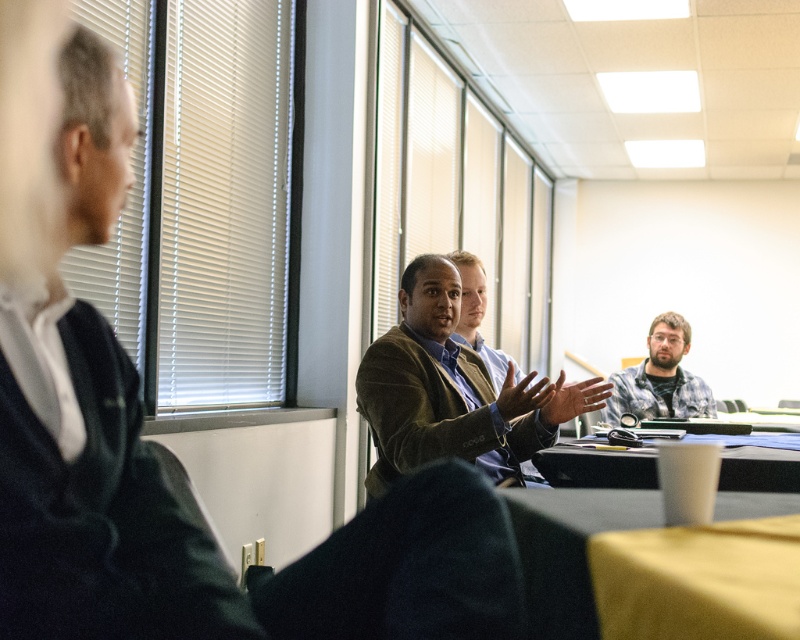
Between velvet brown blazer at center and yellow fabric table at lower right, which one has less height?

yellow fabric table at lower right

Does velvet brown blazer at center appear over yellow fabric table at lower right?

Correct, velvet brown blazer at center is located above yellow fabric table at lower right.

I want to click on velvet brown blazer at center, so click(x=452, y=392).

Measure the distance between black plastic table at lower right and plaid shirt at center.

black plastic table at lower right is 1.35 meters from plaid shirt at center.

Which of these two, black plastic table at lower right or plaid shirt at center, stands shorter?

black plastic table at lower right is shorter.

Does point (617, 480) come in front of point (628, 381)?

Yes, point (617, 480) is closer to viewer.

The image size is (800, 640). Find the location of `black plastic table at lower right`. black plastic table at lower right is located at coordinates (598, 467).

At what (x,y) coordinates should I click in order to perform the action: click on yellow fabric table at lower right. Please return your answer as a coordinate pair (x, y). Looking at the image, I should click on (570, 548).

Which is in front, point (576, 554) or point (688, 413)?

Positioned in front is point (576, 554).

At what (x,y) coordinates should I click in order to perform the action: click on yellow fabric table at lower right. Please return your answer as a coordinate pair (x, y). This screenshot has width=800, height=640. Looking at the image, I should click on (570, 548).